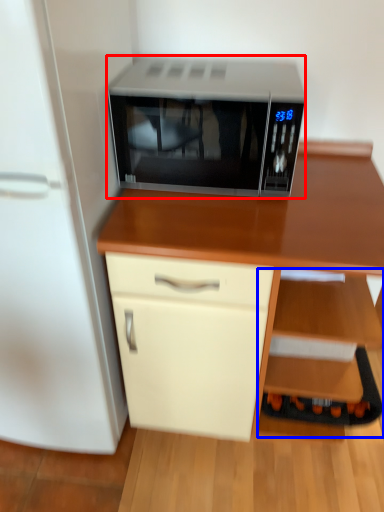
Question: Which object is closer to the camera taking this photo, microwave oven (highlighted by a red box) or shelf (highlighted by a blue box)?

Choices:
 (A) microwave oven
 (B) shelf

Answer: (A)